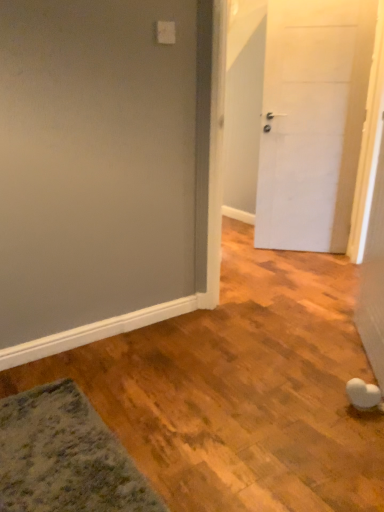
Where is `vacant space underneath white matte door at upper right (from a real-world perspective)`? This screenshot has width=384, height=512. vacant space underneath white matte door at upper right (from a real-world perspective) is located at coordinates (305, 248).